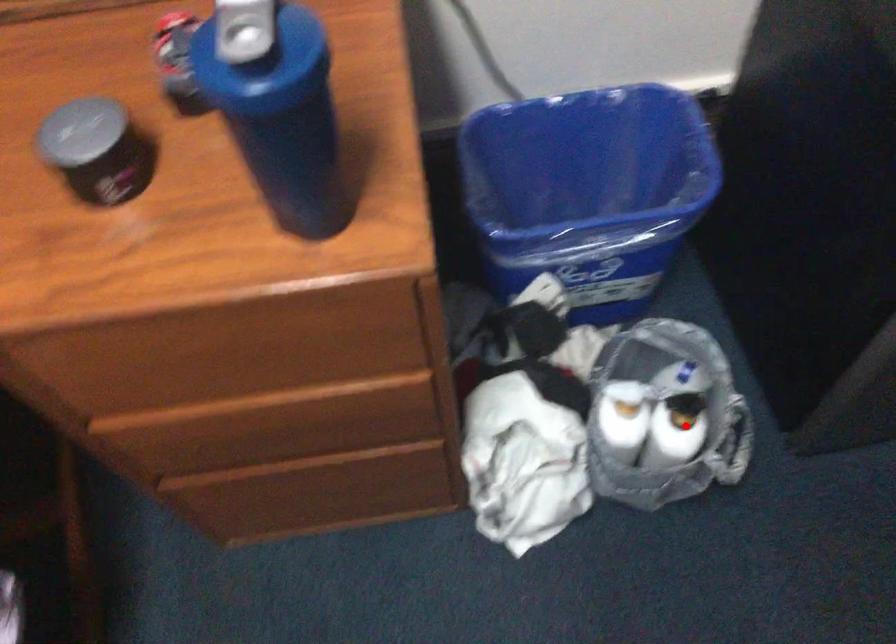
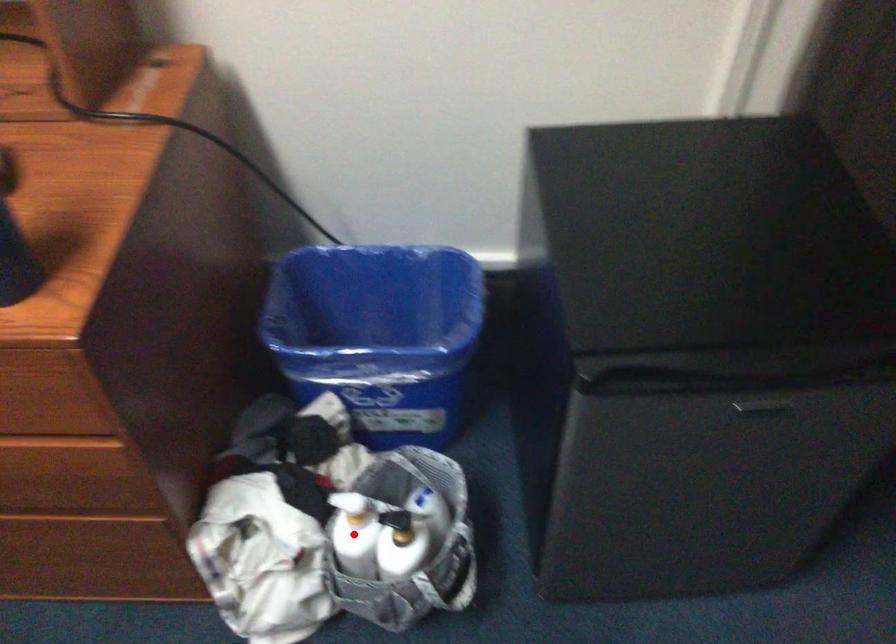
I am providing you with two images of the same scene from different viewpoints. A red point is marked on the first image and another point is marked on the second image. Does the point marked in image1 correspond to the same location as the one in image2?

No